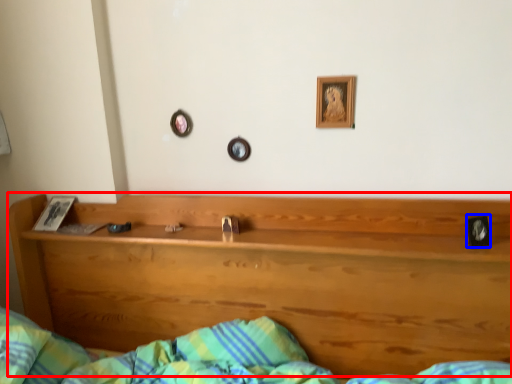
Question: Which point is further to the camera, bunk bed (highlighted by a red box) or picture frame (highlighted by a blue box)?

Choices:
 (A) bunk bed
 (B) picture frame

Answer: (B)